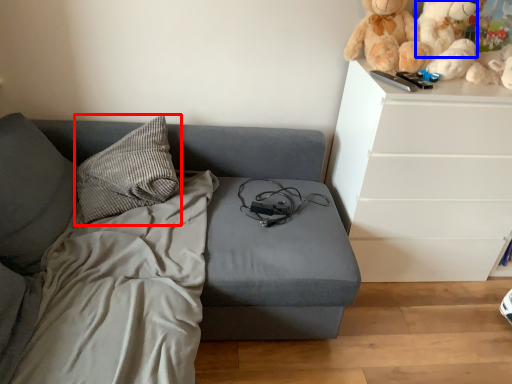
Question: Among these objects, which one is farthest to the camera, pillow (highlighted by a red box) or teddy (highlighted by a blue box)?

Choices:
 (A) pillow
 (B) teddy

Answer: (B)